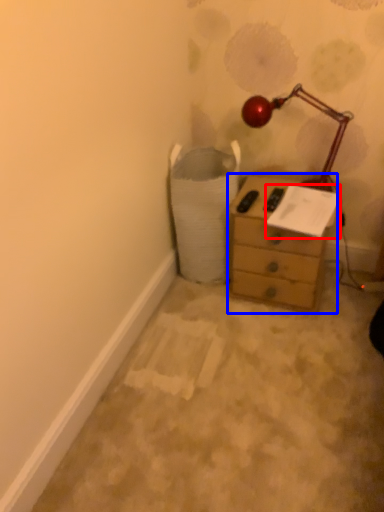
Question: Which object appears closest to the camera in this image, paper (highlighted by a red box) or chest of drawers (highlighted by a blue box)?

Choices:
 (A) paper
 (B) chest of drawers

Answer: (A)